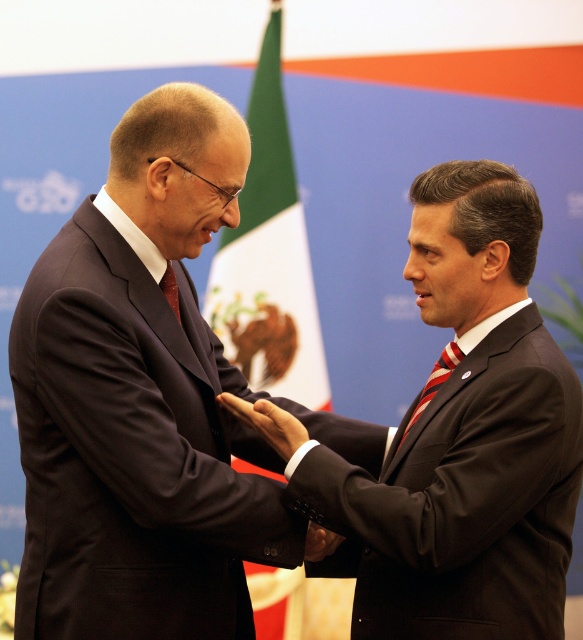
You are a photographer at a diplomatic event. You need to capture a photo where the green fabric flag at center is clearly visible without being blocked by the matte red tie at center. Based on their positions, can you adjust your camera angle to achieve this?

The green fabric flag at center is positioned over the matte red tie at center, so adjusting the camera angle slightly downward would allow the flag to remain visible while moving the tie out of the frame or reducing its obstruction.

You are a photographer at an official event. You need to capture a clear shot of the dark suit at center and the smooth skin hand at center. Which object should you focus on first to ensure both are in focus?

The dark suit at center is closer to the viewer than the smooth skin hand at center. To ensure both are in focus, focus on the dark suit at center first, as it is closer, and use a smaller aperture or adjust your focus point accordingly.

You are a photographer at an official event. You need to capture a photo where both the green fabric flag at center and the matte red tie at center are visible. Based on their positions, which object should be placed on the right side of the photo to ensure both are in frame?

The green fabric flag at center should be placed on the right side of the photo because it is positioned on the right side of the matte red tie at center, ensuring both objects are visible when framed properly.